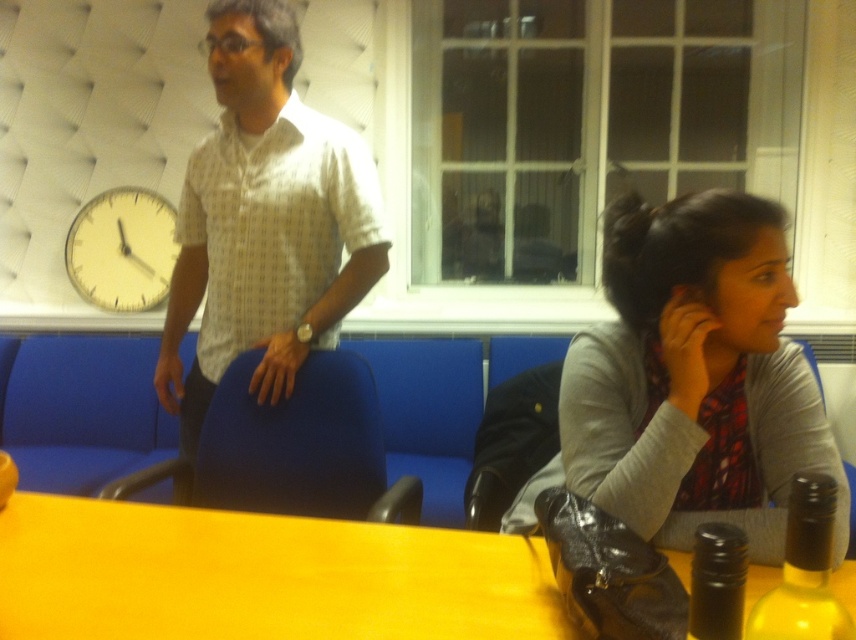
Does white dotted shirt at center have a greater height compared to yellow matte clock at upper left?

Answer: Yes.

Is white dotted shirt at center further to the viewer compared to yellow matte clock at upper left?

No.

Find the location of a particular element. white dotted shirt at center is located at coordinates (265, 224).

Does yellow matte table at lower center have a smaller size compared to yellow matte clock at upper left?

Actually, yellow matte table at lower center might be larger than yellow matte clock at upper left.

Who is more distant from viewer, (x=201, y=544) or (x=117, y=234)?

Point (x=117, y=234)

Identify the location of yellow matte table at lower center. This screenshot has height=640, width=856. (260, 577).

Is yellow matte table at lower center closer to the viewer compared to white dotted shirt at center?

That is True.

Who is more forward, (313, 518) or (339, 257)?

Point (313, 518) is in front.

Where is `yellow matte table at lower center`? This screenshot has height=640, width=856. yellow matte table at lower center is located at coordinates (260, 577).